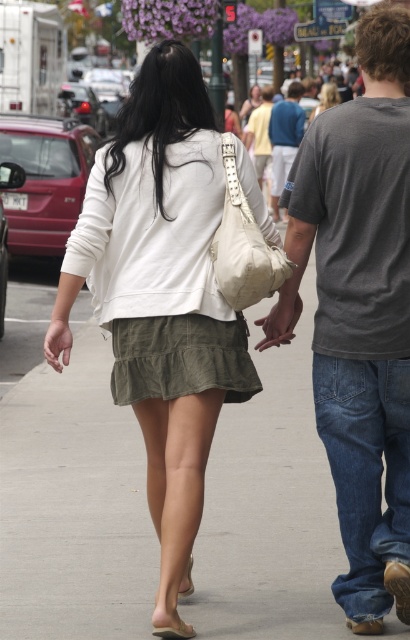
Who is positioned more to the left, green cotton skirt at center or blue cotton shirt at center?

green cotton skirt at center

Who is more forward, (91, 230) or (298, 136)?

Point (91, 230)

You are a GUI agent. You are given a task and a screenshot of the screen. Output one action in this format:
    pyautogui.click(x=<x>, y=<y>)
    Task: Click on the green cotton skirt at center
    This screenshot has width=410, height=640.
    Given the screenshot: What is the action you would take?
    pyautogui.click(x=161, y=273)

How much distance is there between green fabric skirt at center and light beige fabric pants at center?

green fabric skirt at center is 16.01 meters away from light beige fabric pants at center.

Which of these two, green fabric skirt at center or light beige fabric pants at center, stands shorter?

green fabric skirt at center is shorter.

Where is `green fabric skirt at center`? This screenshot has height=640, width=410. green fabric skirt at center is located at coordinates [73, 506].

Find the location of `green fabric skirt at center`. green fabric skirt at center is located at coordinates (73, 506).

Is green cotton skirt at center to the left of light beige fabric pants at center from the viewer's perspective?

Yes, green cotton skirt at center is to the left of light beige fabric pants at center.

Is point (145, 220) closer to camera compared to point (246, 141)?

Yes, point (145, 220) is in front of point (246, 141).

You are a GUI agent. You are given a task and a screenshot of the screen. Output one action in this format:
    pyautogui.click(x=<x>, y=<y>)
    Task: Click on the green cotton skirt at center
    The image size is (410, 640).
    Given the screenshot: What is the action you would take?
    pyautogui.click(x=161, y=273)